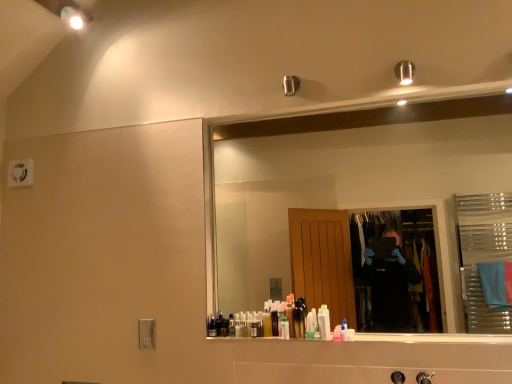
Question: Is translucent plastic tube at center, the second toiletry viewed from the left, taller than translucent plastic bottle at center, which is the third toiletry from right to left?

Choices:
 (A) yes
 (B) no

Answer: (B)

Question: Considering the relative sizes of translucent plastic tube at center, the second toiletry viewed from the left, and translucent plastic bottle at center, which is the third toiletry from right to left, in the image provided, is translucent plastic tube at center, the second toiletry viewed from the left, bigger than translucent plastic bottle at center, which is the third toiletry from right to left,?

Choices:
 (A) yes
 (B) no

Answer: (B)

Question: From the image's perspective, is translucent plastic tube at center, the fifth toiletry viewed from the right, beneath translucent plastic bottle at center, which is counted as the 4th toiletry, starting from the left?

Choices:
 (A) no
 (B) yes

Answer: (B)

Question: Is translucent plastic tube at center, the fifth toiletry viewed from the right, at the left side of translucent plastic bottle at center, which is counted as the 4th toiletry, starting from the left?

Choices:
 (A) yes
 (B) no

Answer: (A)

Question: Is translucent plastic tube at center, the second toiletry viewed from the left, at the right side of translucent plastic bottle at center, which is the third toiletry from right to left?

Choices:
 (A) yes
 (B) no

Answer: (B)

Question: From their relative heights in the image, would you say translucent plastic bottle at center, which is the third toiletry from right to left, is taller or shorter than white glossy lotion at center, the 2th toiletry from the right?

Choices:
 (A) short
 (B) tall

Answer: (B)

Question: Considering their positions, is translucent plastic bottle at center, which is the third toiletry from right to left, located in front of or behind white glossy lotion at center, the 2th toiletry from the right?

Choices:
 (A) front
 (B) behind

Answer: (B)

Question: Based on their positions, is translucent plastic bottle at center, which is the third toiletry from right to left, located to the left or right of white glossy lotion at center, the 2th toiletry from the right?

Choices:
 (A) left
 (B) right

Answer: (A)

Question: Is point (308, 319) positioned closer to the camera than point (324, 304)?

Choices:
 (A) farther
 (B) closer

Answer: (B)

Question: In terms of width, does translucent plastic bottle at center, the 4th toiletry when ordered from right to left, look wider or thinner when compared to pink translucent bottle at center, the 6th toiletry from the left?

Choices:
 (A) wide
 (B) thin

Answer: (B)

Question: Relative to pink translucent bottle at center, which is the first toiletry in right-to-left order, is translucent plastic bottle at center, the 4th toiletry when ordered from right to left, in front or behind?

Choices:
 (A) front
 (B) behind

Answer: (B)

Question: In terms of height, does translucent plastic bottle at center, the 4th toiletry when ordered from right to left, look taller or shorter compared to pink translucent bottle at center, which is the first toiletry in right-to-left order?

Choices:
 (A) tall
 (B) short

Answer: (A)

Question: From a real-world perspective, relative to pink translucent bottle at center, which is the first toiletry in right-to-left order, is translucent plastic bottle at center, the 4th toiletry when ordered from right to left, vertically above or below?

Choices:
 (A) below
 (B) above

Answer: (B)

Question: Considering their positions, is clear glass mirror at upper center located in front of or behind translucent plastic bottle at center, the 4th toiletry when ordered from right to left?

Choices:
 (A) behind
 (B) front

Answer: (B)

Question: Looking at the image, does clear glass mirror at upper center seem bigger or smaller compared to translucent plastic bottle at center, which is the third toiletry from left to right?

Choices:
 (A) small
 (B) big

Answer: (B)